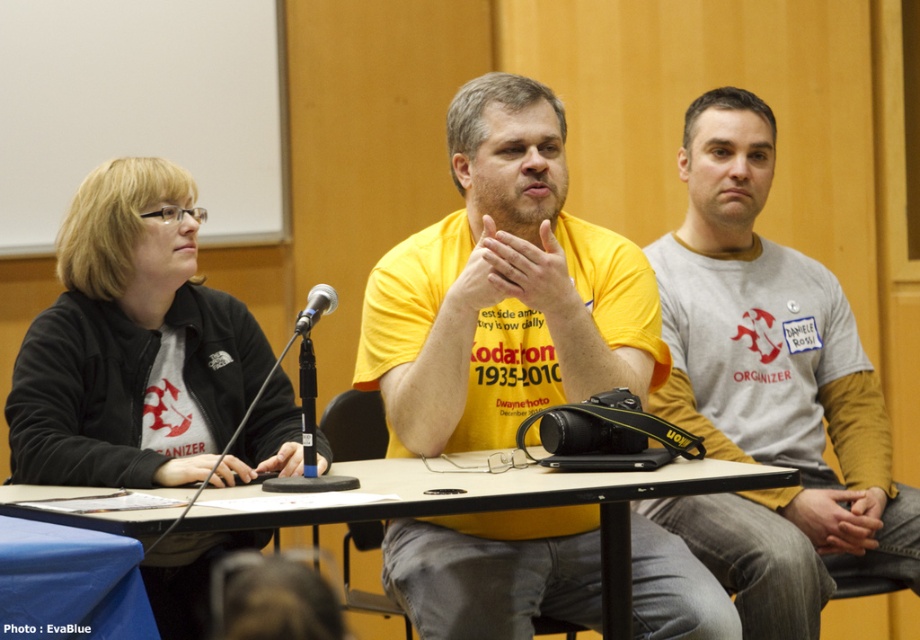
Which of these two, gray cotton shirt at center or black fabric jacket at left, stands taller?

Standing taller between the two is gray cotton shirt at center.

Who is more forward, (683, 410) or (238, 316)?

Point (238, 316) is more forward.

You are a GUI agent. You are given a task and a screenshot of the screen. Output one action in this format:
    pyautogui.click(x=<x>, y=<y>)
    Task: Click on the gray cotton shirt at center
    Image resolution: width=920 pixels, height=640 pixels.
    Given the screenshot: What is the action you would take?
    pyautogui.click(x=769, y=390)

How distant is yellow matte shirt at center from black fabric jacket at left?

yellow matte shirt at center and black fabric jacket at left are 19.29 inches apart from each other.

Does yellow matte shirt at center have a lesser width compared to black fabric jacket at left?

In fact, yellow matte shirt at center might be wider than black fabric jacket at left.

Image resolution: width=920 pixels, height=640 pixels. Describe the element at coordinates (504, 289) in the screenshot. I see `yellow matte shirt at center` at that location.

Identify the location of yellow matte shirt at center. This screenshot has height=640, width=920. (504, 289).

Does black fabric jacket at left have a smaller size compared to black metallic microphone at center?

Actually, black fabric jacket at left might be larger than black metallic microphone at center.

Is point (242, 401) positioned behind point (295, 321)?

That is False.

Does point (247, 339) come in front of point (331, 304)?

That is False.

I want to click on black fabric jacket at left, so click(x=144, y=352).